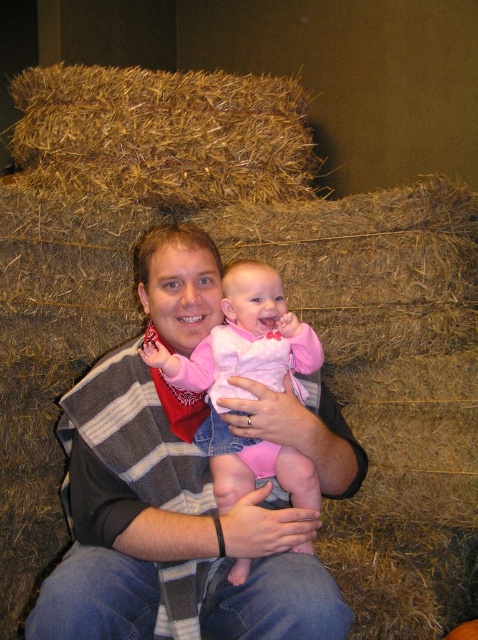
Does striped wool sweater at center appear over pink fleece baby at center?

Incorrect, striped wool sweater at center is not positioned above pink fleece baby at center.

Between striped wool sweater at center and pink fleece baby at center, which one has less height?

Standing shorter between the two is pink fleece baby at center.

What do you see at coordinates (170, 531) in the screenshot? The height and width of the screenshot is (640, 478). I see `striped wool sweater at center` at bounding box center [170, 531].

The image size is (478, 640). Find the location of `striped wool sweater at center`. striped wool sweater at center is located at coordinates (170, 531).

Is brown straw bale at upper left further to the viewer compared to pink fleece baby at center?

That is True.

Is point (160, 145) in front of point (270, 468)?

No, (160, 145) is behind (270, 468).

Is point (156, 112) positioned before point (228, 371)?

That is False.

You are a GUI agent. You are given a task and a screenshot of the screen. Output one action in this format:
    pyautogui.click(x=<x>, y=<y>)
    Task: Click on the brown straw bale at upper left
    
    Given the screenshot: What is the action you would take?
    pyautogui.click(x=164, y=134)

In the scene shown: Is striped wool sweater at center positioned behind brown straw bale at upper left?

No, it is not.

In order to click on striped wool sweater at center in this screenshot , I will do `click(170, 531)`.

Locate an element on the screen. This screenshot has width=478, height=640. striped wool sweater at center is located at coordinates (170, 531).